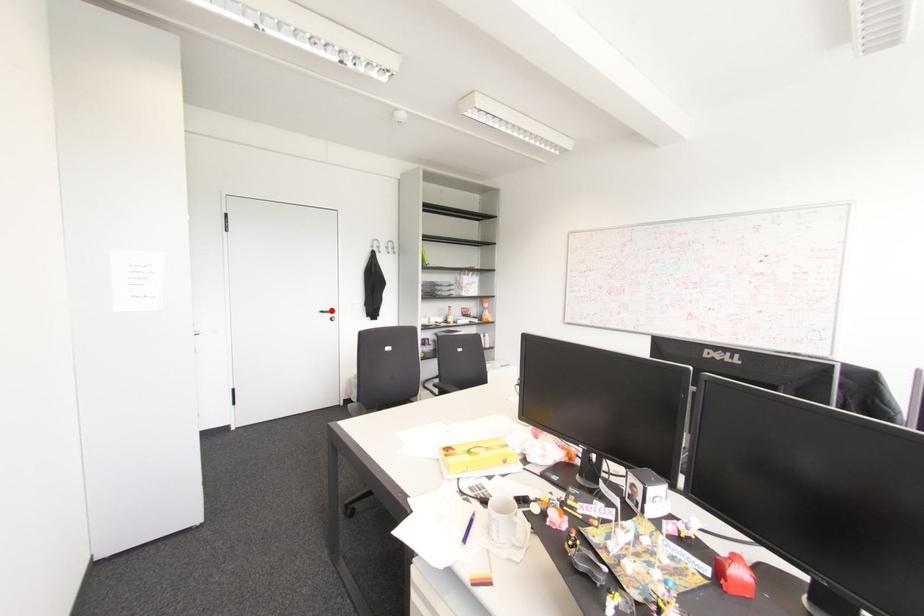
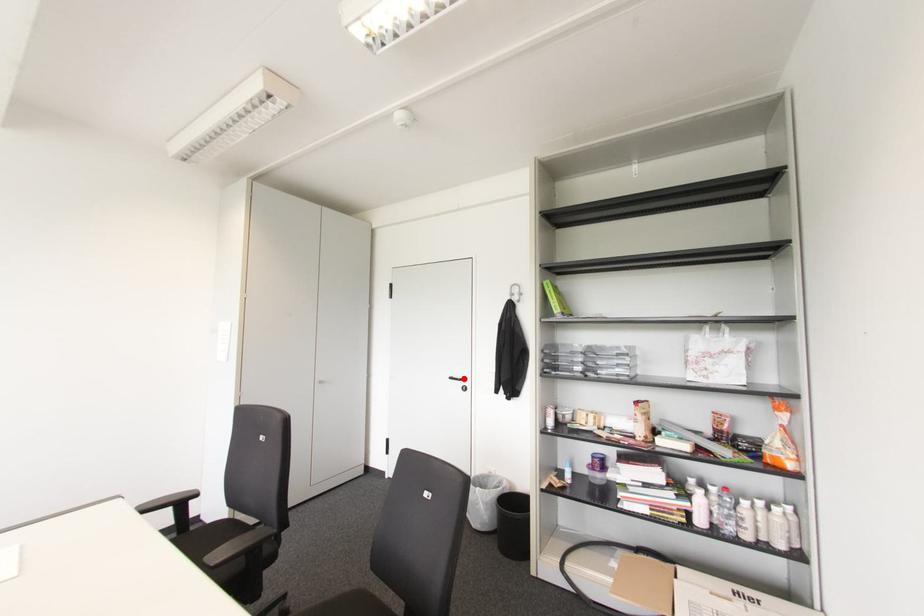
I am providing you with two images of the same scene from different viewpoints. A red point is marked on the first image and another point is marked on the second image. Is the marked point in image1 the same physical position as the marked point in image2?

Yes